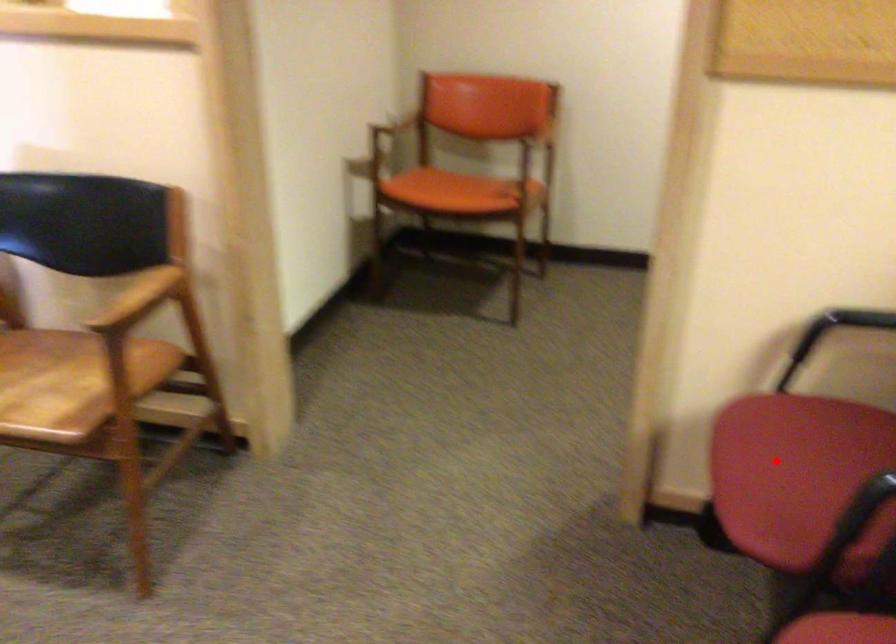
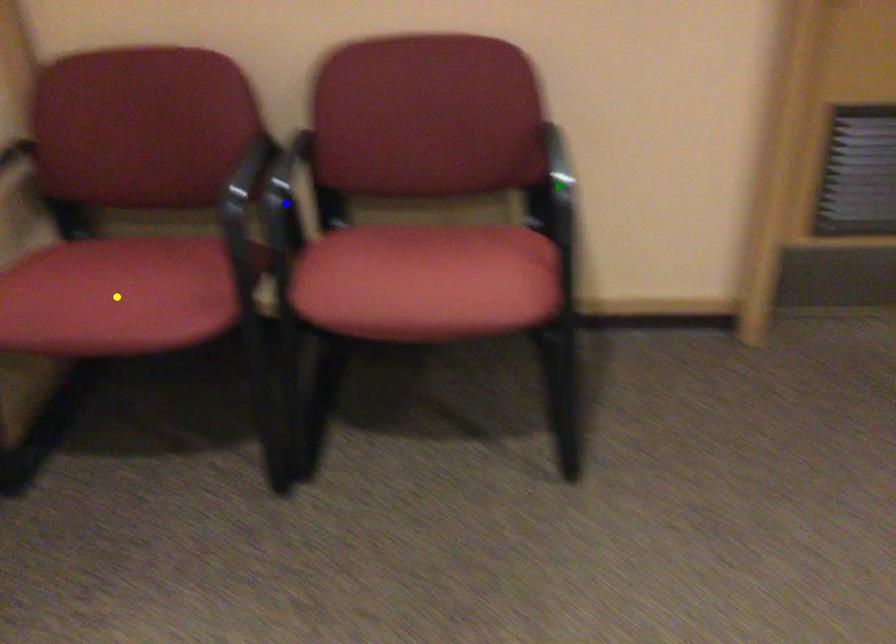
Question: I am providing you with two images of the same scene from different viewpoints. A red point is marked on the first image. You are given multiple points on the second image. Can you choose the point in image 2 that corresponds to the point in image 1?

Choices:
 (A) yellow point
 (B) blue point
 (C) green point

Answer: (A)